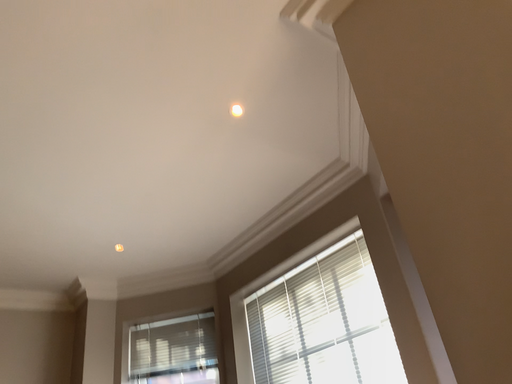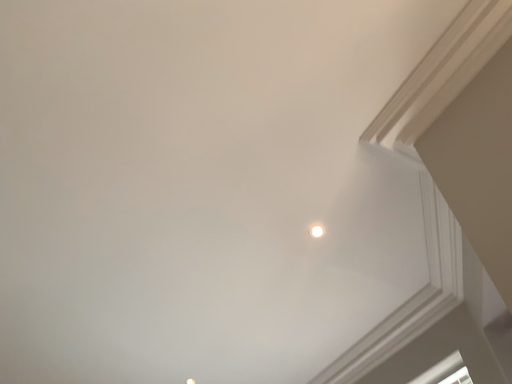
Question: Which way did the camera rotate in the video?

Choices:
 (A) rotated left
 (B) rotated right

Answer: (A)